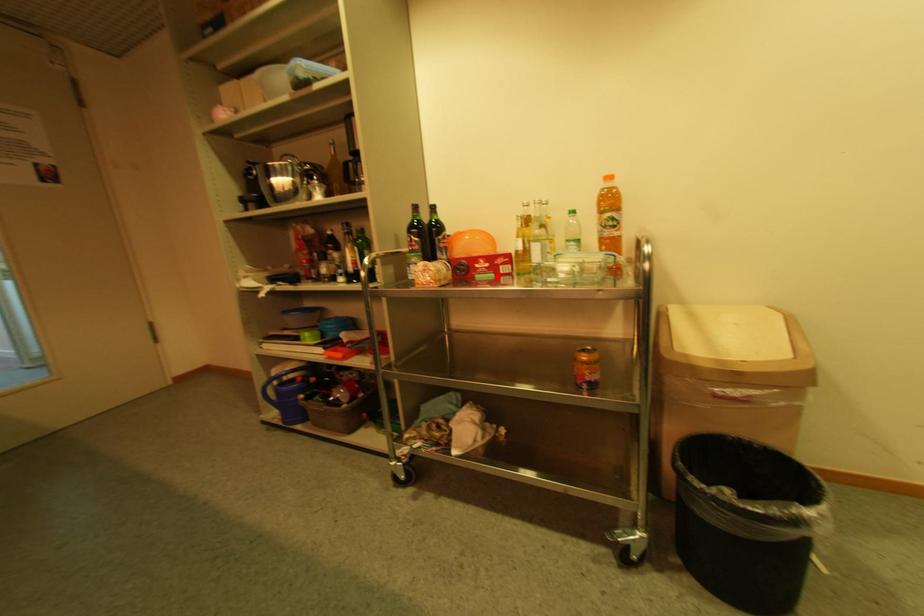
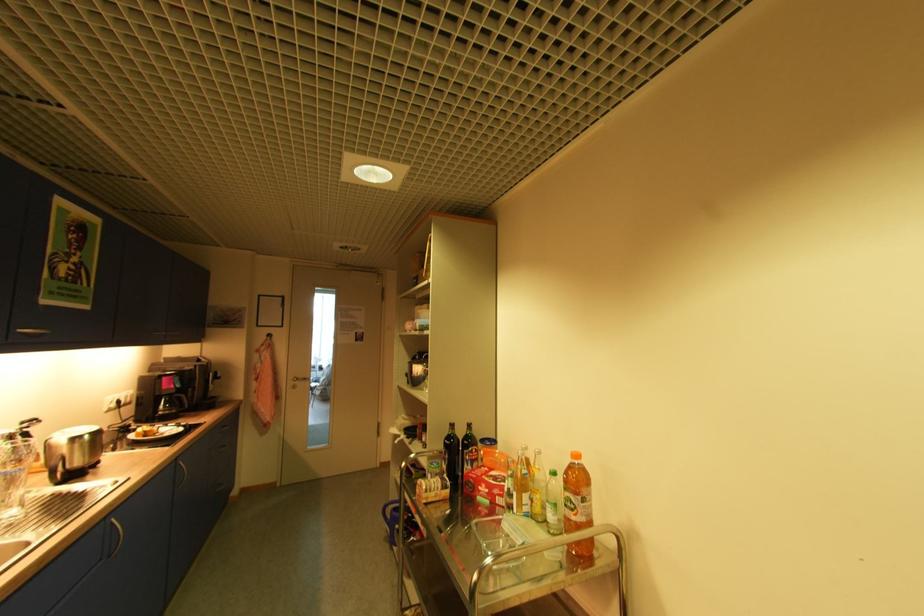
Where in the second image is the point corresponding to the highlighted location from the first image?

(492, 503)